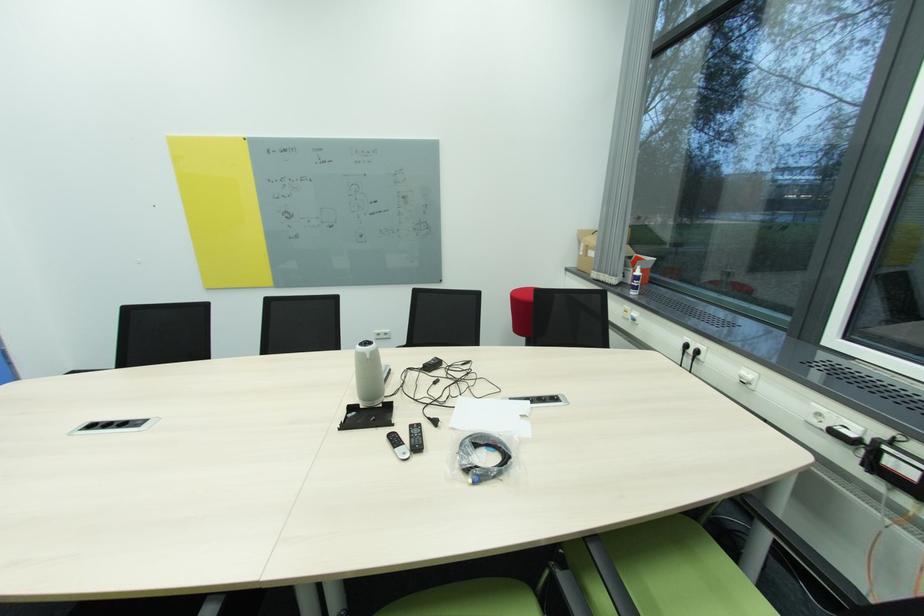
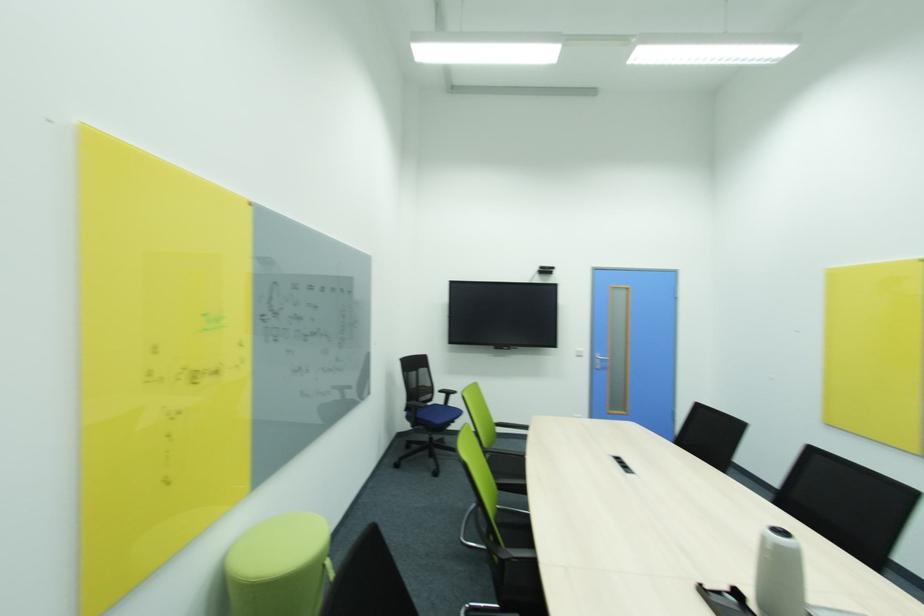
Question: Based on the continuous images, in which direction is the camera rotating? Reply with the corresponding letter.

Choices:
 (A) Left
 (B) Right
 (C) Up
 (D) Down

Answer: (A)